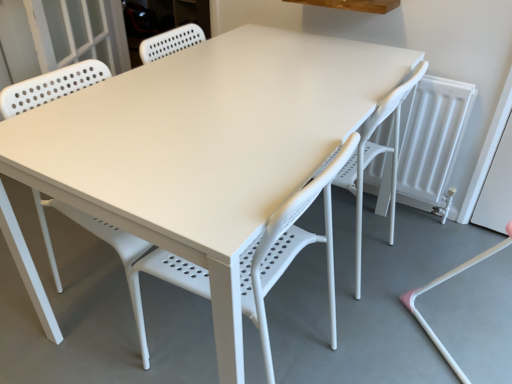
Locate an element on the screen. The width and height of the screenshot is (512, 384). vacant space in front of white plastic swivel chair at lower right is located at coordinates (355, 322).